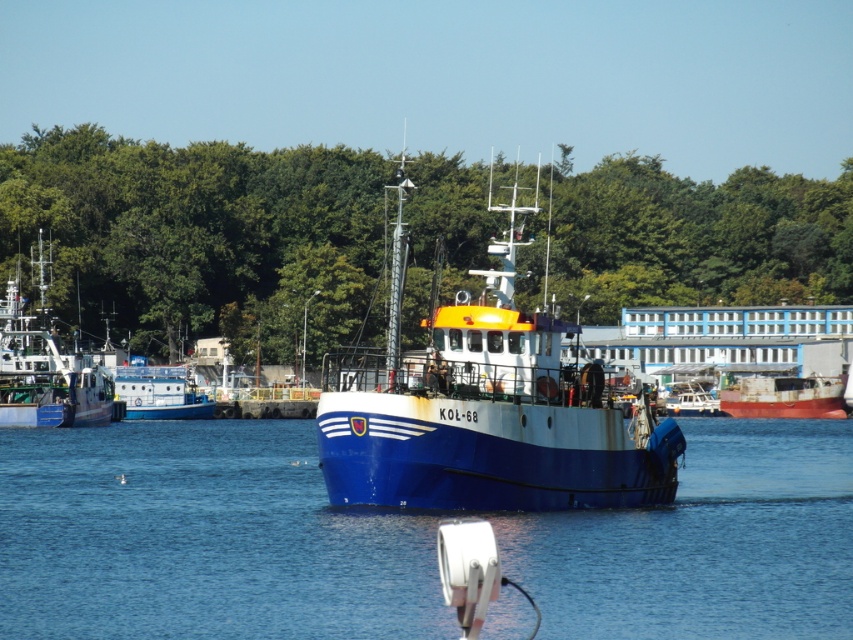
You are standing at the edge of the harbor looking out at the scene. There are two points marked in the image. One is at coordinates point (701,515) and the other is at point (78,403). Which point is closer to you?

Point (701,515) is closer to the camera than point (78,403).

You are a photographer planning to capture the blue water at center and the blue matte fishing boat at left in a single frame. Based on their sizes in the image, which object would appear larger in your photo?

The blue matte fishing boat at left appears larger in the photo because it is bigger than the blue water at center.

You are a photographer planning to capture the harbor scene. You notice the blue water at center and the green leafy trees at upper center. Which of these two elements occupies a smaller vertical space in the image?

The blue water at center has a lesser height compared to the green leafy trees at upper center, so the blue water at center occupies a smaller vertical space in the image.